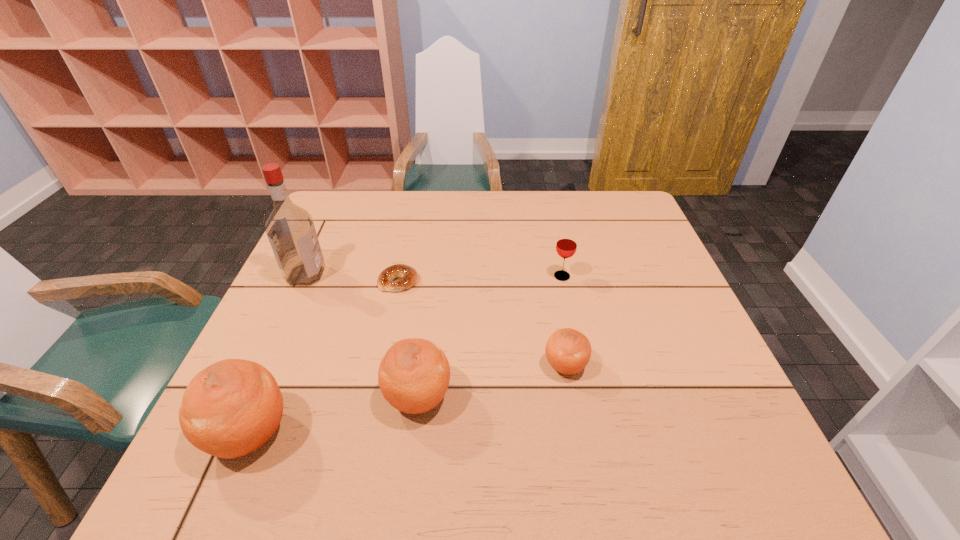
Locate an element on the screen. This screenshot has height=540, width=960. free region located 0.320m on the back of the shortest object is located at coordinates (414, 206).

Locate an element on the screen. This screenshot has height=540, width=960. vacant region located 0.160m on the right of the glass is located at coordinates (632, 276).

This screenshot has width=960, height=540. I want to click on free space located on the front-facing side of the liquor, so click(425, 275).

Image resolution: width=960 pixels, height=540 pixels. I want to click on orange that is at the left edge, so tap(231, 408).

The height and width of the screenshot is (540, 960). I want to click on liquor at the left edge, so click(290, 229).

In order to click on object situated at the near left corner in this screenshot , I will do `click(231, 408)`.

This screenshot has height=540, width=960. In order to click on vacant space at the far edge in this screenshot , I will do `click(410, 191)`.

The width and height of the screenshot is (960, 540). Identify the location of free point at the near edge. (653, 417).

Locate an element on the screen. This screenshot has height=540, width=960. blank area at the left edge is located at coordinates (320, 305).

In the image, there is a desktop. Identify the location of vacant region at the right edge. The height and width of the screenshot is (540, 960). (648, 340).